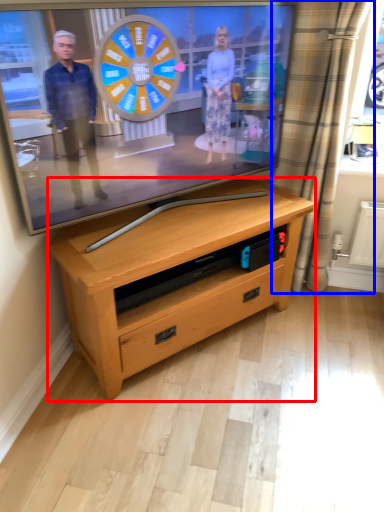
Question: Which object appears closest to the camera in this image, chest of drawers (highlighted by a red box) or curtain (highlighted by a blue box)?

Choices:
 (A) chest of drawers
 (B) curtain

Answer: (A)